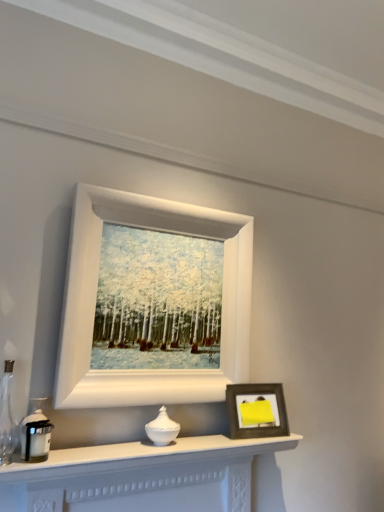
Where is `free area in between wooden photo frame at lower right, which is counted as the second picture frame, starting from the top, and white glossy vase at center, the second candle holder viewed from the front`? The height and width of the screenshot is (512, 384). free area in between wooden photo frame at lower right, which is counted as the second picture frame, starting from the top, and white glossy vase at center, the second candle holder viewed from the front is located at coordinates (213, 438).